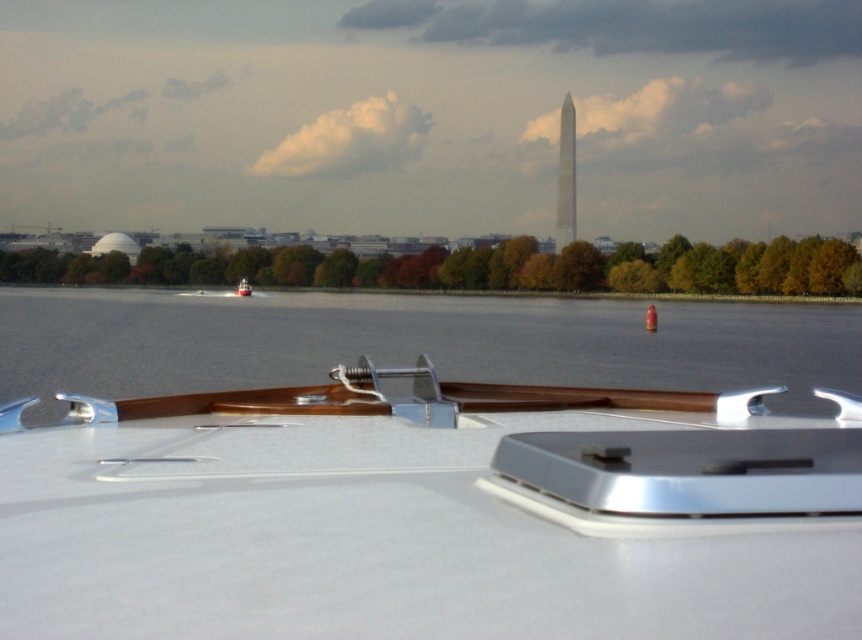
You are standing on the deck of the boat and want to take a photo of the distant cityscape. The camera you have can focus on objects up to 1.5 meters away. Will the white glossy boat at center be in focus?

The white glossy boat at center is 1.21 meters away from the camera, which is within the camera focus range of up to 1.5 meters. Therefore, the white glossy boat at center will be in focus.

You are on a boat deck and want to know which object in the scene is bigger between the clear water at center and the metallic red boat at center. According to the scene, which one is larger?

The clear water at center has a larger size compared to the metallic red boat at center, so the clear water at center is bigger.

You are a photographer on the deck of the boat. You want to capture both the white glossy boat at center and the metallic red boat at center in a single frame. Which boat will appear smaller in your photo?

The white glossy boat at center will appear smaller in the photo because it occupies less space than the metallic red boat at center.